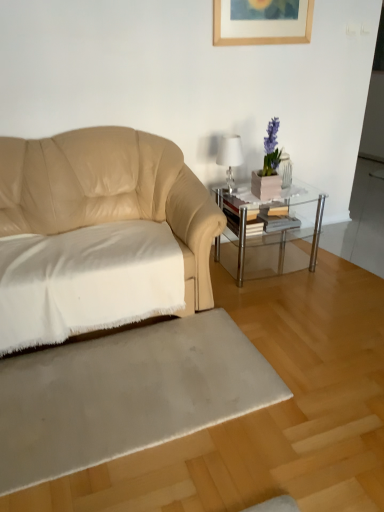
You are a GUI agent. You are given a task and a screenshot of the screen. Output one action in this format:
    pyautogui.click(x=<x>, y=<y>)
    Task: Click on the vacant area that lies in front of clear glass table at center
    The width and height of the screenshot is (384, 512).
    Given the screenshot: What is the action you would take?
    pyautogui.click(x=283, y=300)